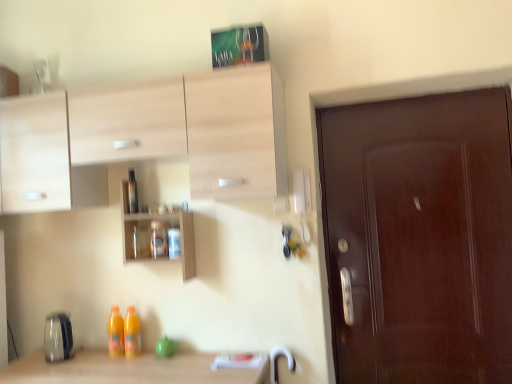
Measure the distance between translucent glass jar at center, which ranks as the second bottle in left-to-right order, and camera.

translucent glass jar at center, which ranks as the second bottle in left-to-right order, and camera are 7.03 feet apart from each other.

The height and width of the screenshot is (384, 512). What do you see at coordinates (164, 236) in the screenshot?
I see `wooden shelves at center` at bounding box center [164, 236].

Identify the location of translucent glass jar at center, which ranks as the second bottle in left-to-right order. (158, 240).

Considering the sizes of objects translucent glass jar at center, the first bottle in the right-to-left sequence, and wooden shelves at center in the image provided, who is smaller, translucent glass jar at center, the first bottle in the right-to-left sequence, or wooden shelves at center?

translucent glass jar at center, the first bottle in the right-to-left sequence, is smaller.

From a real-world perspective, which object stands above the other?

From a 3D spatial view, wooden shelves at center is above.

Measure the distance between translucent glass jar at center, the first bottle in the right-to-left sequence, and wooden shelves at center.

3.43 inches.

Considering the relative sizes of wooden shelves at center and transparent plastic bottle at center, the second bottle positioned from the right, in the image provided, is wooden shelves at center wider than transparent plastic bottle at center, the second bottle positioned from the right,?

Correct, the width of wooden shelves at center exceeds that of transparent plastic bottle at center, the second bottle positioned from the right.

Is wooden shelves at center facing towards transparent plastic bottle at center, positioned as the 1th bottle in top-to-bottom order?

Yes, wooden shelves at center is oriented towards transparent plastic bottle at center, positioned as the 1th bottle in top-to-bottom order.

Which is in front, point (123, 241) or point (133, 169)?

Positioned in front is point (123, 241).

From the picture: Considering the relative positions of wooden shelves at center and transparent plastic bottle at center, the 1th bottle in the left-to-right sequence, in the image provided, is wooden shelves at center to the left of transparent plastic bottle at center, the 1th bottle in the left-to-right sequence, from the viewer's perspective?

No.

The width and height of the screenshot is (512, 384). I want to click on bottle behind the translucent glass jar at center, placed as the second bottle when sorted from top to bottom, so click(132, 192).

Based on the photo, measure the distance from translucent glass jar at center, which ranks as the second bottle in left-to-right order, to transparent plastic bottle at center, the 1th bottle in the left-to-right sequence.

A distance of 8.61 inches exists between translucent glass jar at center, which ranks as the second bottle in left-to-right order, and transparent plastic bottle at center, the 1th bottle in the left-to-right sequence.

Does point (150, 243) come in front of point (138, 210)?

Yes, point (150, 243) is closer to viewer.

From a real-world perspective, which object rests below the other?

translucent glass jar at center, which ranks as the second bottle in left-to-right order.

In the image, is transparent plastic bottle at center, the second bottle ordered from the bottom, on the left side or the right side of translucent glass jar at center, placed as the 1th bottle when sorted from bottom to top?

In the image, transparent plastic bottle at center, the second bottle ordered from the bottom, appears on the left side of translucent glass jar at center, placed as the 1th bottle when sorted from bottom to top.

Considering the positions of objects transparent plastic bottle at center, the second bottle ordered from the bottom, and translucent glass jar at center, placed as the second bottle when sorted from top to bottom, in the image provided, who is behind, transparent plastic bottle at center, the second bottle ordered from the bottom, or translucent glass jar at center, placed as the second bottle when sorted from top to bottom,?

transparent plastic bottle at center, the second bottle ordered from the bottom, is more distant.

Is wooden shelves at center facing away from translucent glass jar at center, placed as the second bottle when sorted from top to bottom?

That's right, wooden shelves at center is facing away from translucent glass jar at center, placed as the second bottle when sorted from top to bottom.

From the image's perspective, between wooden shelves at center and translucent glass jar at center, the first bottle in the right-to-left sequence, who is located below?

translucent glass jar at center, the first bottle in the right-to-left sequence, appears lower in the image.

From a real-world perspective, is wooden shelves at center positioned above or below translucent glass jar at center, which ranks as the second bottle in left-to-right order?

Clearly, from a real-world perspective, wooden shelves at center is above translucent glass jar at center, which ranks as the second bottle in left-to-right order.

Consider the image. Is transparent plastic bottle at center, positioned as the 1th bottle in top-to-bottom order, next to wooden shelves at center and touching it?

transparent plastic bottle at center, positioned as the 1th bottle in top-to-bottom order, and wooden shelves at center are not in contact.

Is transparent plastic bottle at center, the second bottle positioned from the right, looking in the opposite direction of wooden shelves at center?

Yes, transparent plastic bottle at center, the second bottle positioned from the right,'s orientation is away from wooden shelves at center.

From the image's perspective, would you say transparent plastic bottle at center, the 1th bottle in the left-to-right sequence, is shown under wooden shelves at center?

Actually, transparent plastic bottle at center, the 1th bottle in the left-to-right sequence, appears above wooden shelves at center in the image.

This screenshot has width=512, height=384. I want to click on shelf that is on the left side of translucent glass jar at center, placed as the 1th bottle when sorted from bottom to top, so (x=164, y=236).

Image resolution: width=512 pixels, height=384 pixels. Find the location of `bottle above the wooden shelves at center (from a real-world perspective)`. bottle above the wooden shelves at center (from a real-world perspective) is located at coordinates (132, 192).

When comparing their distances from wooden shelves at center, does transparent plastic bottle at center, the second bottle ordered from the bottom, or translucent glass jar at center, placed as the second bottle when sorted from top to bottom, seem closer?

Based on the image, translucent glass jar at center, placed as the second bottle when sorted from top to bottom, appears to be nearer to wooden shelves at center.

Estimate the real-world distances between objects in this image. Which object is further from translucent glass jar at center, which ranks as the second bottle in left-to-right order, transparent plastic bottle at center, positioned as the 1th bottle in top-to-bottom order, or wooden shelves at center?

Based on the image, transparent plastic bottle at center, positioned as the 1th bottle in top-to-bottom order, appears to be further to translucent glass jar at center, which ranks as the second bottle in left-to-right order.

From the image, which object appears to be farther from wooden shelves at center, translucent glass jar at center, placed as the second bottle when sorted from top to bottom, or transparent plastic bottle at center, the second bottle ordered from the bottom?

transparent plastic bottle at center, the second bottle ordered from the bottom, lies further to wooden shelves at center than the other object.

Looking at the image, which one is located closer to transparent plastic bottle at center, positioned as the 1th bottle in top-to-bottom order, wooden shelves at center or translucent glass jar at center, the first bottle in the right-to-left sequence?

The object closer to transparent plastic bottle at center, positioned as the 1th bottle in top-to-bottom order, is wooden shelves at center.

Considering their positions, is translucent glass jar at center, the first bottle in the right-to-left sequence, positioned closer to transparent plastic bottle at center, the second bottle ordered from the bottom, than wooden shelves at center?

Based on the image, wooden shelves at center appears to be nearer to transparent plastic bottle at center, the second bottle ordered from the bottom.

Which object lies nearer to the anchor point translucent glass jar at center, placed as the 1th bottle when sorted from bottom to top, wooden shelves at center or transparent plastic bottle at center, the second bottle ordered from the bottom?

wooden shelves at center is closer to translucent glass jar at center, placed as the 1th bottle when sorted from bottom to top.

Image resolution: width=512 pixels, height=384 pixels. Identify the location of shelf between transparent plastic bottle at center, the 1th bottle in the left-to-right sequence, and translucent glass jar at center, which ranks as the second bottle in left-to-right order, from top to bottom. (164, 236).